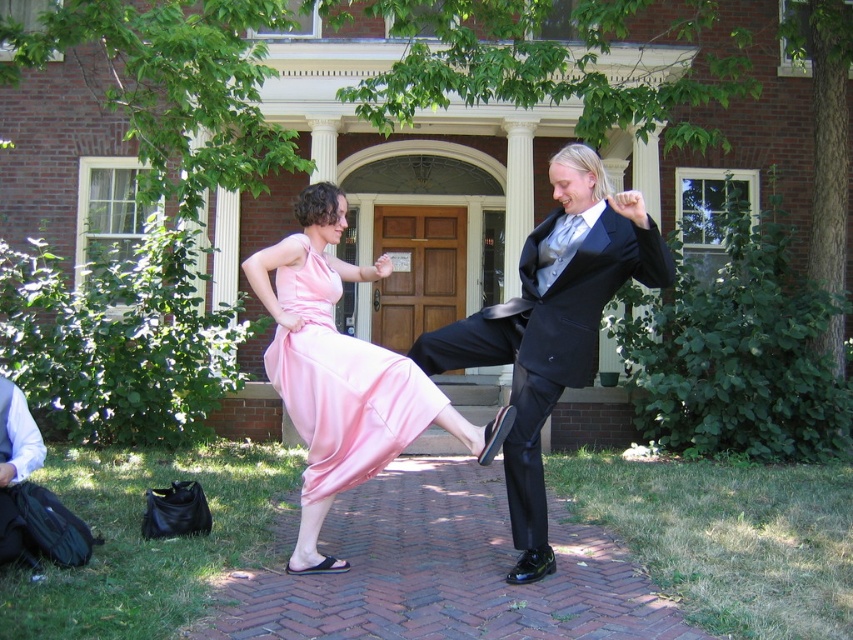
Does satin pink dress at center come behind pink satin dress at center?

No, satin pink dress at center is closer to the viewer.

Is satin pink dress at center wider than pink satin dress at center?

Indeed, satin pink dress at center has a greater width compared to pink satin dress at center.

Is point (363, 380) positioned after point (384, 433)?

No, (363, 380) is closer to viewer.

Locate an element on the screen. satin pink dress at center is located at coordinates (341, 372).

Identify the location of shiny black suit at center. The width and height of the screenshot is (853, 640). (552, 324).

The width and height of the screenshot is (853, 640). What are the coordinates of `shiny black suit at center` in the screenshot? It's located at click(x=552, y=324).

The height and width of the screenshot is (640, 853). I want to click on shiny black suit at center, so click(552, 324).

Is point (508, 467) farther from viewer compared to point (349, 269)?

That is False.

Can you confirm if shiny black suit at center is bigger than satin pink dress at center?

Indeed, shiny black suit at center has a larger size compared to satin pink dress at center.

Where is `shiny black suit at center`? The height and width of the screenshot is (640, 853). shiny black suit at center is located at coordinates (552, 324).